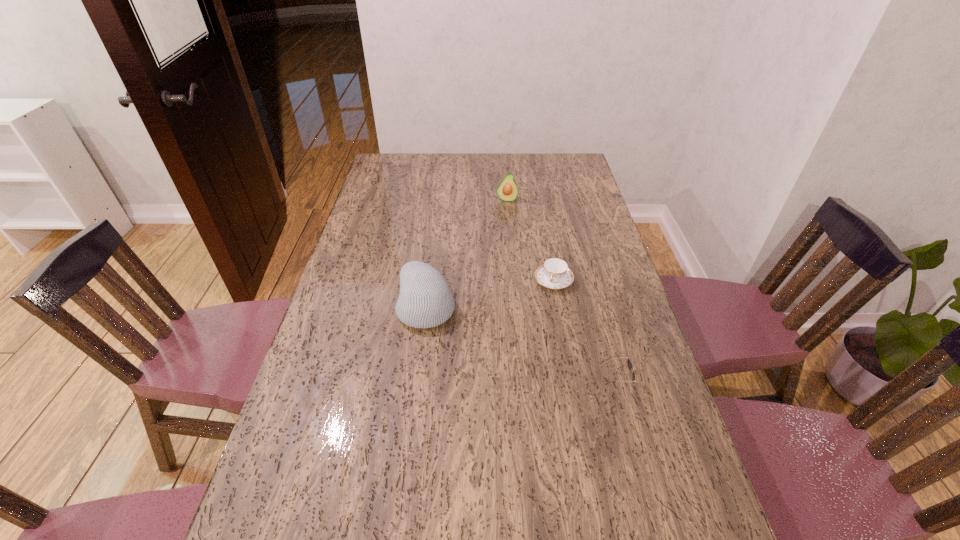
In order to click on free space on the desktop that is between the beanie and the third tallest object and is positioned on the side with the handle of the teacup in this screenshot , I will do `click(529, 349)`.

Image resolution: width=960 pixels, height=540 pixels. In order to click on vacant space on the desktop that is between the leftmost object and the nearest object and is positioned on the cut side of the farthest object in this screenshot , I will do `click(497, 336)`.